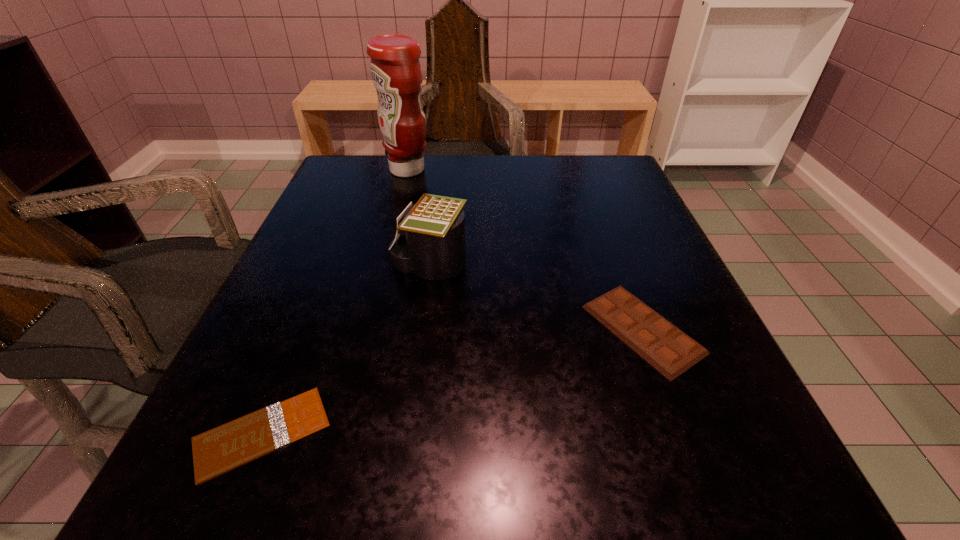
Image resolution: width=960 pixels, height=540 pixels. Find the location of `free space at the left edge of the desktop`. free space at the left edge of the desktop is located at coordinates (366, 267).

Locate an element on the screen. Image resolution: width=960 pixels, height=540 pixels. vacant space at the right edge of the desktop is located at coordinates (655, 418).

Locate an element on the screen. vacant region at the far left corner of the desktop is located at coordinates (364, 175).

This screenshot has height=540, width=960. In order to click on free region at the near left corner of the desktop in this screenshot , I will do `click(264, 500)`.

At what (x,y) coordinates should I click in order to perform the action: click on free space at the far right corner of the desktop. Please return your answer as a coordinate pair (x, y). The image size is (960, 540). Looking at the image, I should click on (575, 179).

At what (x,y) coordinates should I click in order to perform the action: click on vacant space at the near right corner of the desktop. Please return your answer as a coordinate pair (x, y). The image size is (960, 540). Looking at the image, I should click on click(665, 501).

This screenshot has width=960, height=540. What are the coordinates of `free space between the left chocolate bar and the third shortest object` in the screenshot? It's located at (346, 348).

Find the location of a particular element. vacant area that lies between the rightmost object and the condiment is located at coordinates (525, 249).

Where is `free space between the rightmost object and the second tallest object`? This screenshot has height=540, width=960. free space between the rightmost object and the second tallest object is located at coordinates (536, 296).

Find the location of a particular element. unoccupied position between the shortest object and the tallest object is located at coordinates (335, 301).